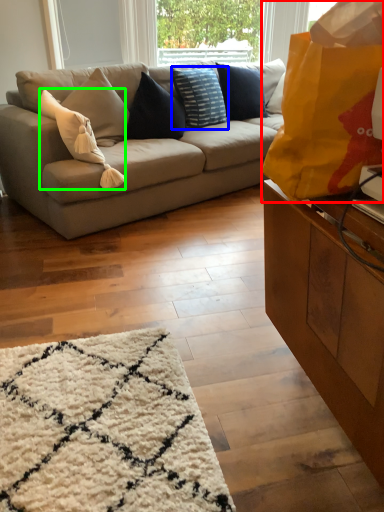
Question: Based on their relative distances, which object is farther from bag (highlighted by a red box)? Choose from pillow (highlighted by a blue box) and pillow (highlighted by a green box).

Choices:
 (A) pillow
 (B) pillow

Answer: (A)